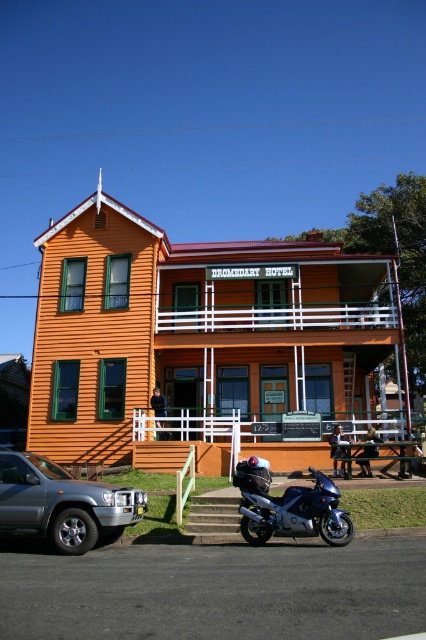
Question: Among these objects, which one is nearest to the camera?

Choices:
 (A) blue metallic motorcycle at lower center
 (B) silver metallic suv at lower left

Answer: (B)

Question: In this image, where is silver metallic suv at lower left located relative to blue metallic motorcycle at lower center?

Choices:
 (A) below
 (B) above

Answer: (B)

Question: Which point is farther to the camera?

Choices:
 (A) (296, 493)
 (B) (78, 484)

Answer: (B)

Question: Does silver metallic suv at lower left have a lesser width compared to blue metallic motorcycle at lower center?

Choices:
 (A) yes
 (B) no

Answer: (B)

Question: Is silver metallic suv at lower left to the right of blue metallic motorcycle at lower center from the viewer's perspective?

Choices:
 (A) yes
 (B) no

Answer: (B)